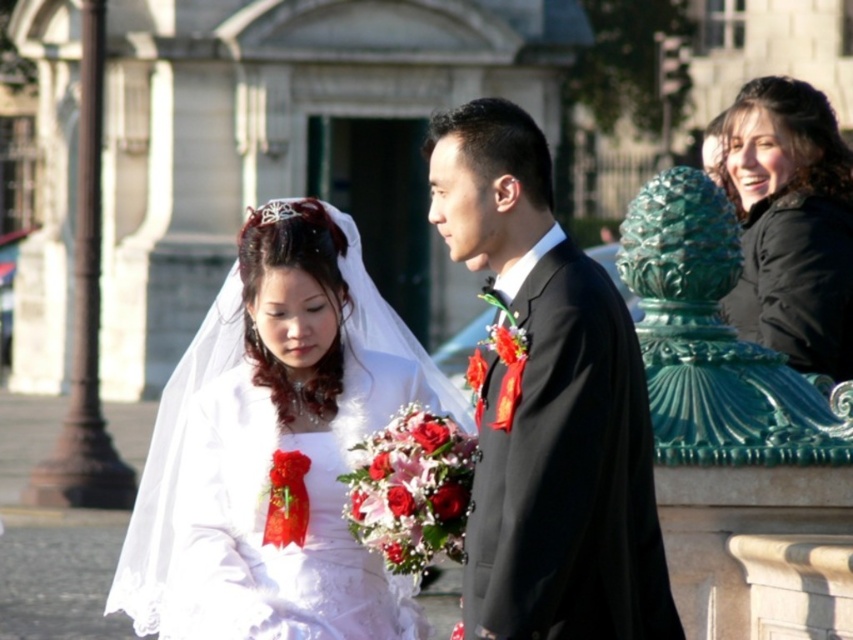
Question: Observing the image, what is the correct spatial positioning of shiny black suit at center in reference to black matte jacket at upper right?

Choices:
 (A) right
 (B) left

Answer: (B)

Question: In this image, where is shiny black suit at center located relative to black matte jacket at upper right?

Choices:
 (A) left
 (B) right

Answer: (A)

Question: Can you confirm if shiny black suit at center is smaller than white satin dress at center?

Choices:
 (A) yes
 (B) no

Answer: (A)

Question: Based on their relative distances, which object is nearer to the white satin dress at center?

Choices:
 (A) black matte jacket at upper right
 (B) shiny black suit at center

Answer: (B)

Question: Which point appears closest to the camera in this image?

Choices:
 (A) (154, 554)
 (B) (469, 156)
 (C) (756, 138)

Answer: (B)

Question: Which of the following is the closest to the observer?

Choices:
 (A) (148, 582)
 (B) (511, 316)

Answer: (B)